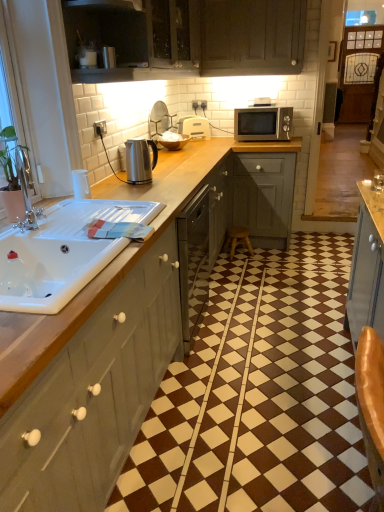
At what (x,y) coordinates should I click in order to perform the action: click on white glossy sink at left. Please return your answer as a coordinate pair (x, y). This screenshot has width=384, height=512. Looking at the image, I should click on (62, 253).

Measure the distance between point (277,15) and camera.

A distance of 3.28 meters exists between point (277,15) and camera.

Identify the location of satin silver kettle at upper center, the second appliance viewed from the front. pyautogui.click(x=173, y=141).

Measure the distance between satin silver microwave at upper right and camera.

satin silver microwave at upper right is 3.42 meters from camera.

This screenshot has height=512, width=384. What do you see at coordinates (140, 161) in the screenshot?
I see `satin silver kettle at center, arranged as the first appliance when viewed from the front` at bounding box center [140, 161].

Find the location of a particular element. This screenshot has height=512, width=384. white glossy sink at left is located at coordinates (62, 253).

Which is further, (201, 51) or (167, 145)?

The point (201, 51) is farther from the camera.

Does dark wood cabinet at upper center, marked as the 1th cabinetry in a top-to-bottom arrangement, have a larger size compared to satin silver kettle at upper center, the 2th appliance viewed from the back?

Indeed, dark wood cabinet at upper center, marked as the 1th cabinetry in a top-to-bottom arrangement, has a larger size compared to satin silver kettle at upper center, the 2th appliance viewed from the back.

From a real-world perspective, which is physically above, dark wood cabinet at upper center, the 3th cabinetry ordered from the bottom, or satin silver kettle at upper center, which is the 2th appliance in top-to-bottom order?

In real-world perspective, dark wood cabinet at upper center, the 3th cabinetry ordered from the bottom, is above.

From the image's perspective, count 2nd cabinetrys upward from the satin silver kettle at upper center, the second appliance viewed from the front, and point to it. Please provide its 2D coordinates.

[(252, 37)]

From the picture: Considering the sizes of satin silver kettle at upper center, the 2th appliance viewed from the back, and white glossy sink at left in the image, is satin silver kettle at upper center, the 2th appliance viewed from the back, wider or thinner than white glossy sink at left?

In the image, satin silver kettle at upper center, the 2th appliance viewed from the back, appears to be more narrow than white glossy sink at left.

Is satin silver kettle at upper center, which is the 2th appliance in top-to-bottom order, beside white glossy sink at left?

satin silver kettle at upper center, which is the 2th appliance in top-to-bottom order, and white glossy sink at left are not in contact.

Is satin silver kettle at upper center, the 2th appliance viewed from the back, in front of or behind white glossy sink at left in the image?

Clearly, satin silver kettle at upper center, the 2th appliance viewed from the back, is behind white glossy sink at left.

Is satin silver kettle at upper center, the 2th appliance viewed from the back, beside matte gray cabinets at left, the first cabinetry when ordered from bottom to top?

There is a gap between satin silver kettle at upper center, the 2th appliance viewed from the back, and matte gray cabinets at left, the first cabinetry when ordered from bottom to top.

Is satin silver kettle at upper center, the second appliance viewed from the front, wider or thinner than matte gray cabinets at left, the first cabinetry when ordered from bottom to top?

Clearly, satin silver kettle at upper center, the second appliance viewed from the front, has less width compared to matte gray cabinets at left, the first cabinetry when ordered from bottom to top.

From a real-world perspective, who is located higher, satin silver kettle at upper center, the second appliance viewed from the front, or matte gray cabinets at left, the first cabinetry when ordered from bottom to top?

satin silver kettle at upper center, the second appliance viewed from the front.

From the image's perspective, is satin silver kettle at upper center, the 2th appliance viewed from the back, on top of matte gray cabinets at left, which is the 3th cabinetry from top to bottom?

Yes, from the image's perspective, satin silver kettle at upper center, the 2th appliance viewed from the back, is over matte gray cabinets at left, which is the 3th cabinetry from top to bottom.

Based on the photo, is satin silver kettle at upper center, the second appliance viewed from the front, completely or partially outside of wooden stool at center?

Yes, satin silver kettle at upper center, the second appliance viewed from the front, is outside of wooden stool at center.

Which of these two, satin silver kettle at upper center, the 2th appliance viewed from the back, or wooden stool at center, is thinner?

With smaller width is wooden stool at center.

Which is nearer, (181, 144) or (236, 232)?

Clearly, point (181, 144) is closer to the camera than point (236, 232).

Between satin silver kettle at upper center, the second appliance viewed from the front, and wooden stool at center, which one appears on the left side from the viewer's perspective?

Positioned to the left is satin silver kettle at upper center, the second appliance viewed from the front.

Which object is closer to the camera taking this photo, satin silver kettle at center, positioned as the 3th appliance in back-to-front order, or satin silver kettle at upper center, placed as the second appliance when sorted from bottom to top?

satin silver kettle at center, positioned as the 3th appliance in back-to-front order, is closer to the camera.

Can you confirm if satin silver kettle at center, which is counted as the third appliance, starting from the top, is positioned to the right of satin silver kettle at upper center, which is the 2th appliance in top-to-bottom order?

In fact, satin silver kettle at center, which is counted as the third appliance, starting from the top, is to the left of satin silver kettle at upper center, which is the 2th appliance in top-to-bottom order.

Between satin silver kettle at center, placed as the first appliance when sorted from bottom to top, and satin silver kettle at upper center, the second appliance viewed from the front, which one has smaller size?

With smaller size is satin silver kettle at center, placed as the first appliance when sorted from bottom to top.

Would you say satin silver kettle at center, which is counted as the third appliance, starting from the top, is outside satin silver kettle at upper center, the second appliance viewed from the front?

That's correct, satin silver kettle at center, which is counted as the third appliance, starting from the top, is outside of satin silver kettle at upper center, the second appliance viewed from the front.

Considering the relative positions of white glossy sink at left and satin silver kettle at center, placed as the first appliance when sorted from bottom to top, in the image provided, is white glossy sink at left to the left of satin silver kettle at center, placed as the first appliance when sorted from bottom to top, from the viewer's perspective?

Yes.

Is white glossy sink at left completely or partially outside of satin silver kettle at center, positioned as the 3th appliance in back-to-front order?

Yes, white glossy sink at left is not within satin silver kettle at center, positioned as the 3th appliance in back-to-front order.

Measure the distance between white glossy sink at left and satin silver kettle at center, which is counted as the third appliance, starting from the top.

They are 29.66 inches apart.

Who is more distant, white glossy sink at left or satin silver kettle at center, placed as the first appliance when sorted from bottom to top?

satin silver kettle at center, placed as the first appliance when sorted from bottom to top, is further away from the camera.

Which object is further away from the camera taking this photo, white glossy sink at left or satin silver kettle at upper center, the second appliance viewed from the front?

satin silver kettle at upper center, the second appliance viewed from the front.

Starting from the white glossy sink at left, which appliance is the 2nd one to the right? Please provide its 2D coordinates.

[(173, 141)]

Is white glossy sink at left oriented away from satin silver kettle at upper center, which is the 2th appliance in top-to-bottom order?

white glossy sink at left is not turned away from satin silver kettle at upper center, which is the 2th appliance in top-to-bottom order.

Identify the location of the 2nd cabinetry above the satin silver kettle at upper center, which is the 2th appliance in top-to-bottom order (from a real-world perspective). The height and width of the screenshot is (512, 384). (252, 37).

Identify the location of the 2nd appliance to the right of the white glossy sink at left, counting from the anchor's position. (173, 141).

From the image, which object appears to be nearer to dark wood cabinet at upper center, the 3th cabinetry ordered from the bottom, white glossy sink at left or matte wood cabinet at upper center, the 2th cabinetry from the top?

The object closer to dark wood cabinet at upper center, the 3th cabinetry ordered from the bottom, is matte wood cabinet at upper center, the 2th cabinetry from the top.

Looking at the image, which one is located closer to wooden stool at center, white glossy sink at left or white plastic toaster at center, the first appliance viewed from the top?

The object closer to wooden stool at center is white plastic toaster at center, the first appliance viewed from the top.

Which object lies further to the anchor point satin silver kettle at upper center, the 2th appliance viewed from the back, matte gray cabinets at left, the first cabinetry when ordered from bottom to top, or satin silver microwave at upper right?

The object further to satin silver kettle at upper center, the 2th appliance viewed from the back, is matte gray cabinets at left, the first cabinetry when ordered from bottom to top.

Considering their positions, is wooden stool at center positioned further to satin silver kettle at center, arranged as the first appliance when viewed from the front, than dark wood cabinet at upper center, the 3th cabinetry ordered from the bottom?

Among the two, dark wood cabinet at upper center, the 3th cabinetry ordered from the bottom, is located further to satin silver kettle at center, arranged as the first appliance when viewed from the front.

Considering their positions, is satin silver microwave at upper right positioned closer to matte gray cabinets at left, the first cabinetry when ordered from bottom to top, than dark wood cabinet at upper center, the 3th cabinetry ordered from the bottom?

Answer: Based on the image, satin silver microwave at upper right appears to be nearer to matte gray cabinets at left, the first cabinetry when ordered from bottom to top.

When comparing their distances from satin silver kettle at center, which is counted as the third appliance, starting from the top, does dark wood cabinet at upper center, the 3th cabinetry ordered from the bottom, or wooden stool at center seem further?

dark wood cabinet at upper center, the 3th cabinetry ordered from the bottom, lies further to satin silver kettle at center, which is counted as the third appliance, starting from the top, than the other object.

Considering their positions, is satin silver kettle at center, which is counted as the third appliance, starting from the top, positioned further to dark wood cabinet at upper center, marked as the 1th cabinetry in a top-to-bottom arrangement, than wooden stool at center?

wooden stool at center is positioned further to the anchor dark wood cabinet at upper center, marked as the 1th cabinetry in a top-to-bottom arrangement.

Considering their positions, is wooden stool at center positioned further to matte wood cabinet at upper center, the 2th cabinetry from the top, than satin silver microwave at upper right?

wooden stool at center lies further to matte wood cabinet at upper center, the 2th cabinetry from the top, than the other object.

This screenshot has height=512, width=384. In order to click on microwave oven between white glossy sink at left and wooden stool at center in the front-back direction in this screenshot , I will do `click(263, 124)`.

At what (x,y) coordinates should I click in order to perform the action: click on microwave oven that lies between dark wood cabinet at upper center, marked as the 1th cabinetry in a top-to-bottom arrangement, and wooden stool at center from top to bottom. Please return your answer as a coordinate pair (x, y). Image resolution: width=384 pixels, height=512 pixels. Looking at the image, I should click on (263, 124).

Find the location of a particular element. sink located between matte gray cabinets at left, which is the 3th cabinetry from top to bottom, and wooden stool at center in the depth direction is located at coordinates (62, 253).

Locate an element on the screen. Image resolution: width=384 pixels, height=512 pixels. cabinetry between dark wood cabinet at upper center, marked as the 1th cabinetry in a top-to-bottom arrangement, and matte gray cabinets at left, the first cabinetry when ordered from bottom to top, from top to bottom is located at coordinates (248, 36).